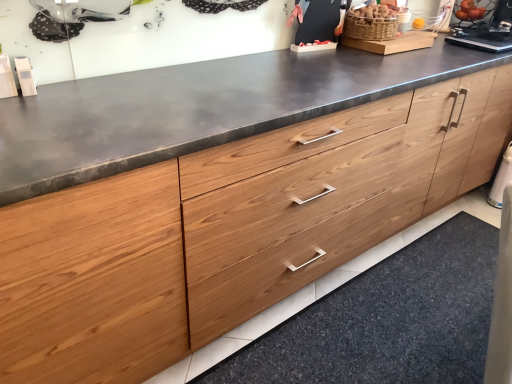
What is the approximate width of natural wood drawer at lower center?

natural wood drawer at lower center is 24.72 inches wide.

Identify the location of natural wood drawer at lower center. pyautogui.click(x=387, y=320).

This screenshot has height=384, width=512. What do you see at coordinates (387, 320) in the screenshot?
I see `natural wood drawer at lower center` at bounding box center [387, 320].

Locate an element on the screen. woven brown basket at upper right is located at coordinates (370, 27).

What do you see at coordinates (370, 27) in the screenshot? Image resolution: width=512 pixels, height=384 pixels. I see `woven brown basket at upper right` at bounding box center [370, 27].

At what (x,y) coordinates should I click in order to perform the action: click on natural wood drawer at lower center. Please return your answer as a coordinate pair (x, y). Looking at the image, I should click on (387, 320).

Based on their positions, is woven brown basket at upper right located to the left or right of natural wood drawer at lower center?

Based on their positions, woven brown basket at upper right is located to the left of natural wood drawer at lower center.

Considering the positions of objects woven brown basket at upper right and natural wood drawer at lower center in the image provided, who is in front, woven brown basket at upper right or natural wood drawer at lower center?

natural wood drawer at lower center is more forward.

Does point (381, 26) appear closer or farther from the camera than point (407, 289)?

Point (381, 26).

From the image's perspective, which is below, woven brown basket at upper right or natural wood drawer at lower center?

From the image's view, natural wood drawer at lower center is below.

From a real-world perspective, is woven brown basket at upper right positioned above or below natural wood drawer at lower center?

From a real-world perspective, woven brown basket at upper right is physically above natural wood drawer at lower center.

Considering the sizes of woven brown basket at upper right and natural wood drawer at lower center in the image, is woven brown basket at upper right wider or thinner than natural wood drawer at lower center?

woven brown basket at upper right is thinner than natural wood drawer at lower center.

Is woven brown basket at upper right taller than natural wood drawer at lower center?

Indeed, woven brown basket at upper right has a greater height compared to natural wood drawer at lower center.

Which of these two, woven brown basket at upper right or natural wood drawer at lower center, is bigger?

natural wood drawer at lower center.

Is natural wood drawer at lower center located within woven brown basket at upper right?

No, natural wood drawer at lower center is not inside woven brown basket at upper right.

Is woven brown basket at upper right touching natural wood drawer at lower center?

woven brown basket at upper right and natural wood drawer at lower center are not in contact.

From the picture: Is woven brown basket at upper right facing away from natural wood drawer at lower center?

woven brown basket at upper right is not turned away from natural wood drawer at lower center.

How different are the orientations of woven brown basket at upper right and natural wood drawer at lower center in degrees?

There is a 0.887-degree angle between the facing directions of woven brown basket at upper right and natural wood drawer at lower center.

This screenshot has width=512, height=384. There is a natural wood drawer at lower center. Find the location of `basket above it (from a real-world perspective)`. basket above it (from a real-world perspective) is located at coordinates (370, 27).

Considering the positions of objects natural wood drawer at lower center and woven brown basket at upper right in the image provided, who is more to the right, natural wood drawer at lower center or woven brown basket at upper right?

Positioned to the right is natural wood drawer at lower center.

Relative to woven brown basket at upper right, is natural wood drawer at lower center in front or behind?

natural wood drawer at lower center is positioned closer to the viewer than woven brown basket at upper right.

Does point (461, 343) lie behind point (346, 35)?

That is False.

Looking at this image, from the image's perspective, relative to woven brown basket at upper right, is natural wood drawer at lower center above or below?

From the image's perspective, natural wood drawer at lower center appears below woven brown basket at upper right.

From a real-world perspective, is natural wood drawer at lower center on top of woven brown basket at upper right?

No, from a real-world perspective, natural wood drawer at lower center is not on top of woven brown basket at upper right.

Between natural wood drawer at lower center and woven brown basket at upper right, which one has smaller width?

woven brown basket at upper right is thinner.

Based on the photo, considering the sizes of objects natural wood drawer at lower center and woven brown basket at upper right in the image provided, who is shorter, natural wood drawer at lower center or woven brown basket at upper right?

natural wood drawer at lower center.

Is natural wood drawer at lower center bigger than woven brown basket at upper right?

Yes, natural wood drawer at lower center is bigger than woven brown basket at upper right.

Is natural wood drawer at lower center not within woven brown basket at upper right?

natural wood drawer at lower center is positioned outside woven brown basket at upper right.

Is natural wood drawer at lower center with woven brown basket at upper right?

No, natural wood drawer at lower center is not making contact with woven brown basket at upper right.

Is natural wood drawer at lower center looking in the opposite direction of woven brown basket at upper right?

natural wood drawer at lower center is not turned away from woven brown basket at upper right.

What's the angular difference between natural wood drawer at lower center and woven brown basket at upper right's facing directions?

0.887 degrees.

Identify the location of granite lying in front of the woven brown basket at upper right. (387, 320).

I want to click on basket above the natural wood drawer at lower center (from the image's perspective), so click(x=370, y=27).

You are a GUI agent. You are given a task and a screenshot of the screen. Output one action in this format:
    pyautogui.click(x=<x>, y=<y>)
    Task: Click on the basket above the natural wood drawer at lower center (from a real-world perspective)
    
    Given the screenshot: What is the action you would take?
    pyautogui.click(x=370, y=27)